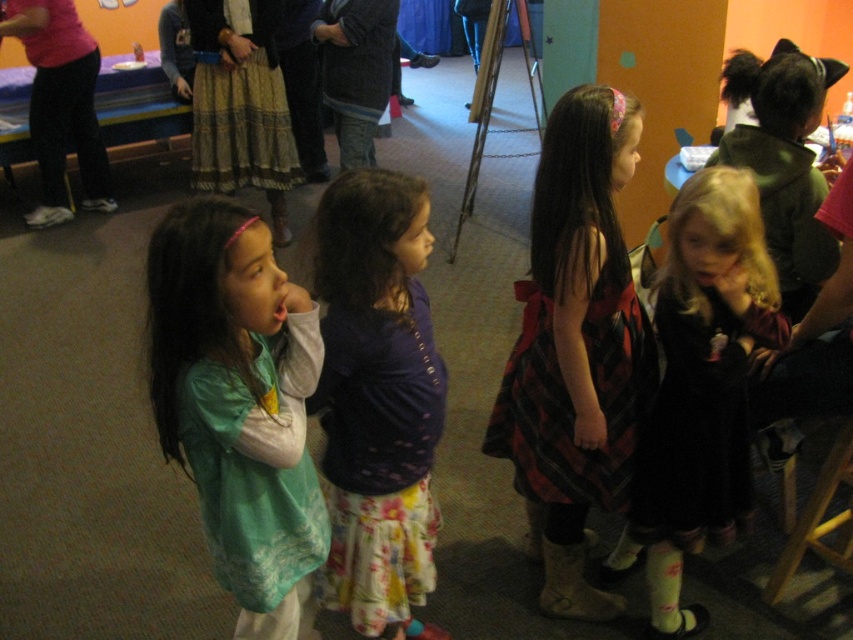
Question: Is floral skirt at center wider than wooden stool at lower right?

Choices:
 (A) no
 (B) yes

Answer: (A)

Question: Which point appears farthest from the camera in this image?

Choices:
 (A) (299, 557)
 (B) (582, 612)
 (C) (844, 424)
 (D) (695, 275)

Answer: (B)

Question: Observing the image, what is the correct spatial positioning of floral skirt at center in reference to black velvet dress at right?

Choices:
 (A) below
 (B) above

Answer: (A)

Question: Which of the following is the farthest from the observer?

Choices:
 (A) floral skirt at center
 (B) wooden stool at lower right
 (C) plaid fabric dress at center

Answer: (B)

Question: Does black velvet dress at right lie in front of wooden stool at lower right?

Choices:
 (A) yes
 (B) no

Answer: (A)

Question: Which point is farther from the camera taking this photo?

Choices:
 (A) pyautogui.click(x=753, y=243)
 (B) pyautogui.click(x=515, y=467)

Answer: (B)